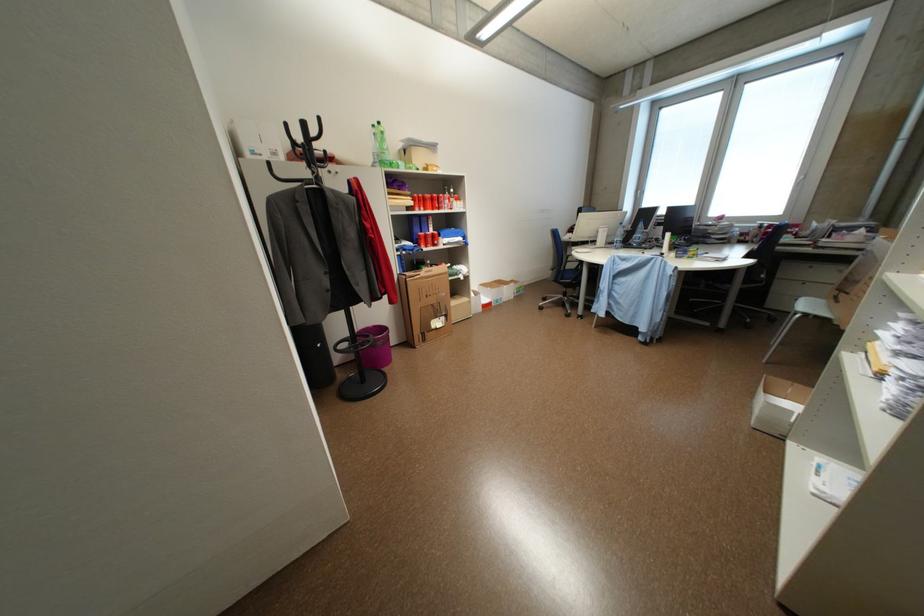
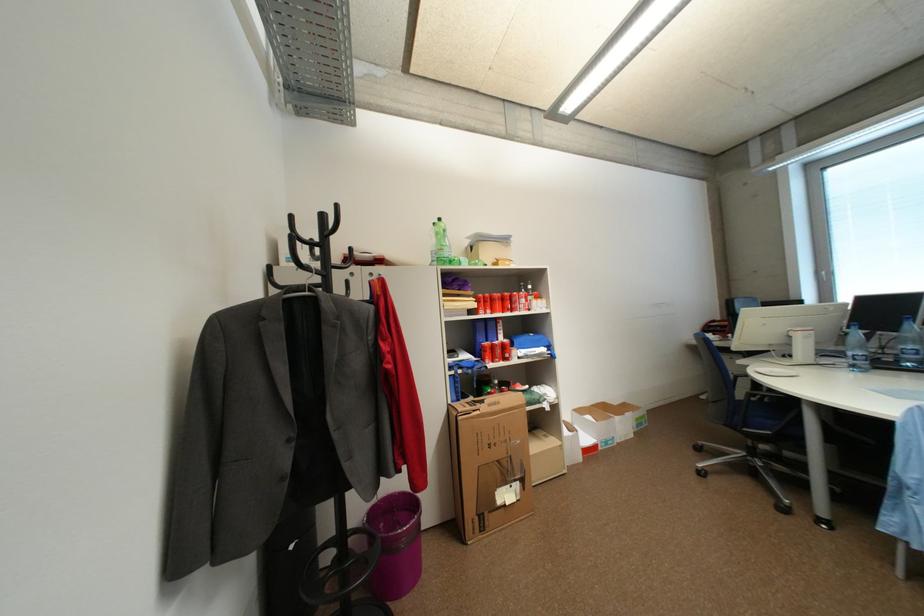
In the second image, find the point that corresponds to the point at 421,201 in the first image.

(485, 302)